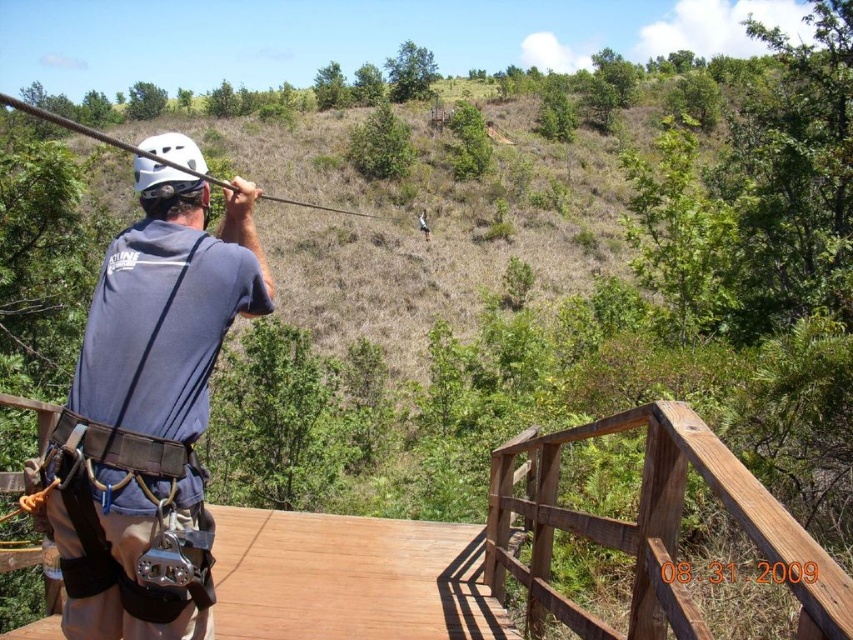
Question: Which object is the closest to the brown wooden rail at lower right?

Choices:
 (A) matte gray shirt at center
 (B) white matte helmet at upper left
 (C) brown wooden bridge at center

Answer: (A)

Question: Can you confirm if matte gray shirt at center is thinner than black matte rope at upper left?

Choices:
 (A) no
 (B) yes

Answer: (B)

Question: Is white matte helmet at upper left bigger than black matte rope at upper left?

Choices:
 (A) yes
 (B) no

Answer: (B)

Question: Which object is closer to the camera taking this photo?

Choices:
 (A) white matte helmet at upper left
 (B) brown wooden rail at lower right
 (C) matte gray shirt at center

Answer: (B)

Question: Which is nearer to the white matte helmet at upper left?

Choices:
 (A) black matte rope at upper left
 (B) matte gray shirt at center

Answer: (B)

Question: Can you confirm if matte gray shirt at center is bigger than white matte helmet at upper left?

Choices:
 (A) yes
 (B) no

Answer: (B)